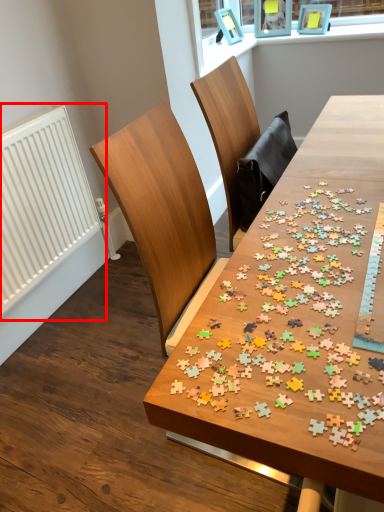
Question: From the image's perspective, where is radiator (annotated by the red box) located relative to table?

Choices:
 (A) above
 (B) below

Answer: (A)